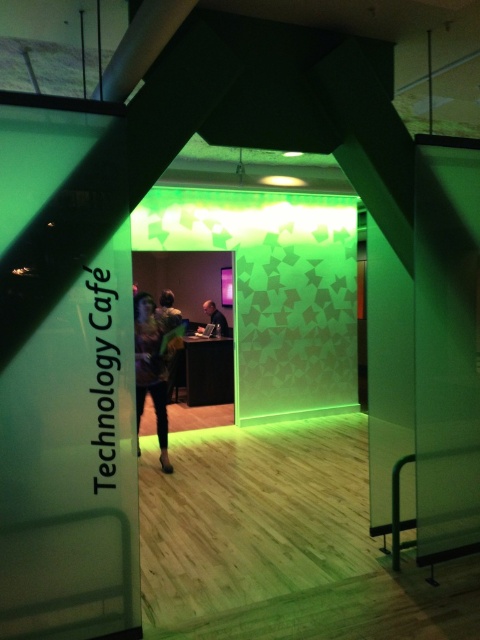
Question: Which point appears closest to the camera in this image?

Choices:
 (A) (137, 385)
 (B) (217, 308)

Answer: (A)

Question: Is patterned fabric dress at center thinner than matte black laptop at center?

Choices:
 (A) no
 (B) yes

Answer: (A)

Question: Does patterned fabric dress at center appear over matte black laptop at center?

Choices:
 (A) yes
 (B) no

Answer: (B)

Question: Which of the following is the farthest from the observer?

Choices:
 (A) matte black laptop at center
 (B) patterned fabric dress at center

Answer: (A)

Question: Does patterned fabric dress at center have a greater width compared to matte black laptop at center?

Choices:
 (A) yes
 (B) no

Answer: (A)